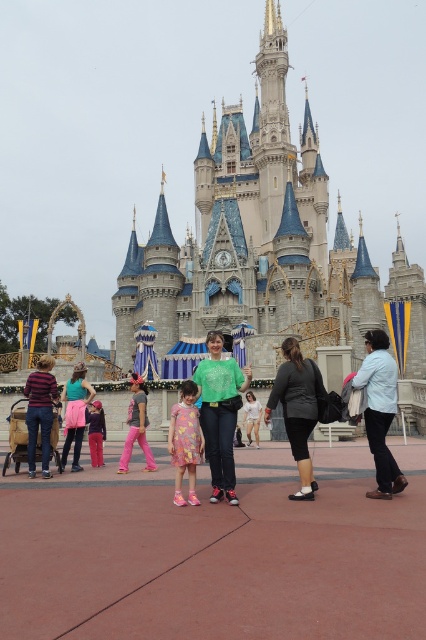
Question: Does green matte shirt at center appear on the right side of pink fabric pants at center?

Choices:
 (A) no
 (B) yes

Answer: (B)

Question: Which point is farther to the camera?

Choices:
 (A) pink fabric pants at center
 (B) dark gray fabric pants at center
 (C) light blue denim jacket at lower right

Answer: (A)

Question: Is stone castle at center smaller than green matte shirt at center?

Choices:
 (A) yes
 (B) no

Answer: (B)

Question: Which point is farther to the camera?

Choices:
 (A) pink fabric pants at center
 (B) green matte shirt at center

Answer: (A)

Question: Is dark gray fabric pants at center to the right of matte pink dress at center from the viewer's perspective?

Choices:
 (A) no
 (B) yes

Answer: (B)

Question: Which of the following is the farthest from the observer?

Choices:
 (A) (131, 387)
 (B) (201, 401)
 (C) (92, 412)

Answer: (A)